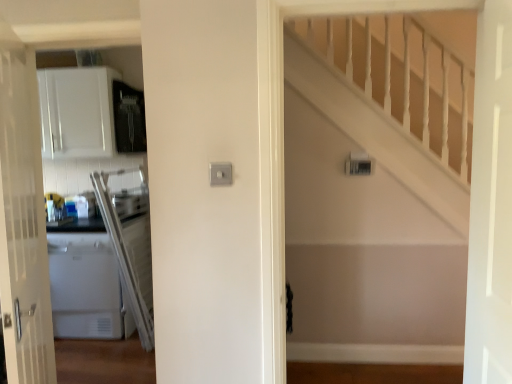
The height and width of the screenshot is (384, 512). Describe the element at coordinates (392, 101) in the screenshot. I see `white wooden staircase at upper right` at that location.

What do you see at coordinates (490, 204) in the screenshot?
I see `white glossy door at right, the 2th door positioned from the left` at bounding box center [490, 204].

Consider the image. What is the approximate height of white glossy door at left, which is the 1th door from left to right?

1.72 meters.

This screenshot has height=384, width=512. In order to click on white wooden staircase at upper right in this screenshot , I will do `click(392, 101)`.

From a real-world perspective, which is physically below, white glossy door at right, arranged as the first door when viewed from the right, or white wooden staircase at upper right?

In real-world perspective, white wooden staircase at upper right is lower.

Which object is closer to the camera, white glossy door at right, the 2th door positioned from the left, or white wooden staircase at upper right?

Positioned in front is white glossy door at right, the 2th door positioned from the left.

Which is closer, (x=485, y=379) or (x=306, y=28)?

Clearly, point (x=485, y=379) is closer to the camera than point (x=306, y=28).

From the image's perspective, which is above, white wooden staircase at upper right or white glossy door at left, which appears as the second door when viewed from the right?

From the image's view, white wooden staircase at upper right is above.

This screenshot has height=384, width=512. I want to click on door that is the 2nd one when counting downward from the white wooden staircase at upper right (from the image's perspective), so click(x=23, y=220).

Are white wooden staircase at upper right and white glossy door at left, which is the 1th door from left to right, located far from each other?

That's right, there is a large distance between white wooden staircase at upper right and white glossy door at left, which is the 1th door from left to right.

Is white glossy door at left, which is the 1th door from left to right, located within white wooden staircase at upper right?

Definitely not — white glossy door at left, which is the 1th door from left to right, is not inside white wooden staircase at upper right.

Considering their positions, is white glossy door at left, which appears as the second door when viewed from the right, located in front of or behind white glossy door at right, the 2th door positioned from the left?

In the image, white glossy door at left, which appears as the second door when viewed from the right, appears behind white glossy door at right, the 2th door positioned from the left.

From the image's perspective, is white glossy door at left, which appears as the second door when viewed from the right, below white glossy door at right, arranged as the first door when viewed from the right?

Indeed, from the image's perspective, white glossy door at left, which appears as the second door when viewed from the right, is shown beneath white glossy door at right, arranged as the first door when viewed from the right.

From the picture: From a real-world perspective, does white glossy door at left, which appears as the second door when viewed from the right, stand above white glossy door at right, the 2th door positioned from the left?

Actually, white glossy door at left, which appears as the second door when viewed from the right, is physically below white glossy door at right, the 2th door positioned from the left, in the real world.

Consider the image. Is white glossy door at left, which is the 1th door from left to right, oriented away from white glossy door at right, arranged as the first door when viewed from the right?

white glossy door at left, which is the 1th door from left to right, does not have its back to white glossy door at right, arranged as the first door when viewed from the right.

Is white wooden staircase at upper right oriented away from white glossy door at right, arranged as the first door when viewed from the right?

That's not correct — white wooden staircase at upper right is not looking away from white glossy door at right, arranged as the first door when viewed from the right.

Which is more to the right, white wooden staircase at upper right or white glossy door at right, the 2th door positioned from the left?

Positioned to the right is white glossy door at right, the 2th door positioned from the left.

Between white glossy door at left, which is the 1th door from left to right, and white wooden staircase at upper right, which one appears on the left side from the viewer's perspective?

white glossy door at left, which is the 1th door from left to right.

Considering the sizes of objects white glossy door at left, which is the 1th door from left to right, and white wooden staircase at upper right in the image provided, who is taller, white glossy door at left, which is the 1th door from left to right, or white wooden staircase at upper right?

Standing taller between the two is white glossy door at left, which is the 1th door from left to right.

From a real-world perspective, between white glossy door at left, which appears as the second door when viewed from the right, and white wooden staircase at upper right, who is vertically lower?

From a 3D spatial view, white glossy door at left, which appears as the second door when viewed from the right, is below.

Looking at the image, does white glossy door at left, which appears as the second door when viewed from the right, seem bigger or smaller compared to white wooden staircase at upper right?

white glossy door at left, which appears as the second door when viewed from the right, is smaller than white wooden staircase at upper right.

From the picture: Is white glossy door at right, the 2th door positioned from the left, behind white glossy door at left, which is the 1th door from left to right?

No, white glossy door at right, the 2th door positioned from the left, is in front of white glossy door at left, which is the 1th door from left to right.

Do you think white glossy door at right, the 2th door positioned from the left, is within white glossy door at left, which appears as the second door when viewed from the right, or outside of it?

white glossy door at right, the 2th door positioned from the left, is located beyond the bounds of white glossy door at left, which appears as the second door when viewed from the right.

Are white glossy door at right, arranged as the first door when viewed from the right, and white glossy door at left, which is the 1th door from left to right, far apart?

white glossy door at right, arranged as the first door when viewed from the right, is positioned a significant distance from white glossy door at left, which is the 1th door from left to right.

Where is `the 1st door below when counting from the white wooden staircase at upper right (from the image's perspective)`? The width and height of the screenshot is (512, 384). the 1st door below when counting from the white wooden staircase at upper right (from the image's perspective) is located at coordinates (490, 204).

I want to click on stairwell located on the right of white glossy door at left, which appears as the second door when viewed from the right, so [x=392, y=101].

Looking at the image, which one is located closer to white wooden staircase at upper right, white glossy door at right, the 2th door positioned from the left, or white glossy door at left, which is the 1th door from left to right?

Based on the image, white glossy door at right, the 2th door positioned from the left, appears to be nearer to white wooden staircase at upper right.

Looking at the image, which one is located further to white glossy door at right, the 2th door positioned from the left, white glossy door at left, which is the 1th door from left to right, or white wooden staircase at upper right?

white glossy door at left, which is the 1th door from left to right, is positioned further to the anchor white glossy door at right, the 2th door positioned from the left.

From the picture: From the image, which object appears to be farther from white wooden staircase at upper right, white glossy door at left, which appears as the second door when viewed from the right, or white glossy door at right, the 2th door positioned from the left?

white glossy door at left, which appears as the second door when viewed from the right, lies further to white wooden staircase at upper right than the other object.

Which object lies nearer to the anchor point white glossy door at left, which appears as the second door when viewed from the right, white wooden staircase at upper right or white glossy door at right, the 2th door positioned from the left?

white glossy door at right, the 2th door positioned from the left, is closer to white glossy door at left, which appears as the second door when viewed from the right.

When comparing their distances from white glossy door at left, which appears as the second door when viewed from the right, does white glossy door at right, the 2th door positioned from the left, or white wooden staircase at upper right seem closer?

white glossy door at right, the 2th door positioned from the left, lies closer to white glossy door at left, which appears as the second door when viewed from the right, than the other object.

Which object lies nearer to the anchor point white glossy door at right, the 2th door positioned from the left, white wooden staircase at upper right or white glossy door at left, which is the 1th door from left to right?

white wooden staircase at upper right is closer to white glossy door at right, the 2th door positioned from the left.

Where is `stairwell located between white glossy door at left, which is the 1th door from left to right, and white glossy door at right, arranged as the first door when viewed from the right, in the left-right direction`? Image resolution: width=512 pixels, height=384 pixels. stairwell located between white glossy door at left, which is the 1th door from left to right, and white glossy door at right, arranged as the first door when viewed from the right, in the left-right direction is located at coordinates (392, 101).